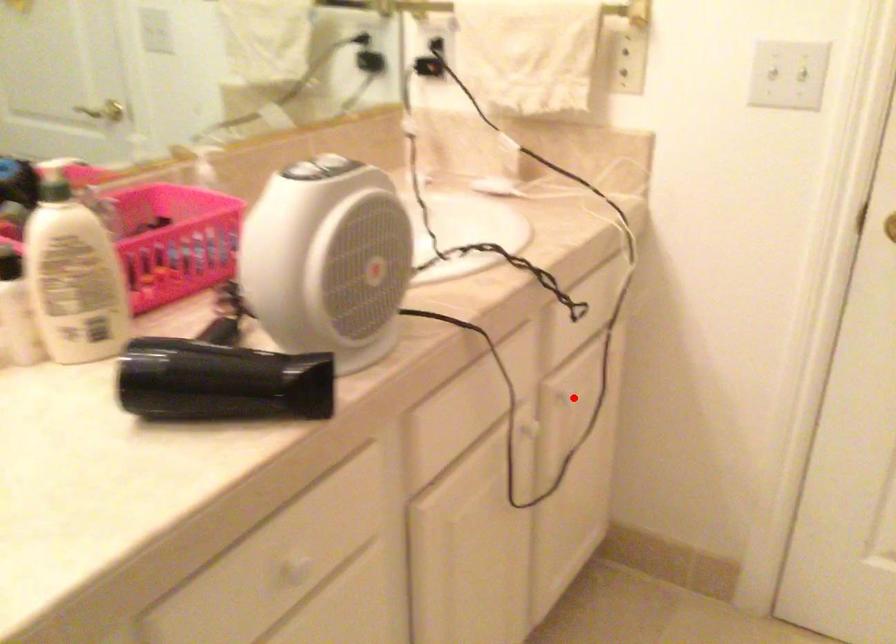
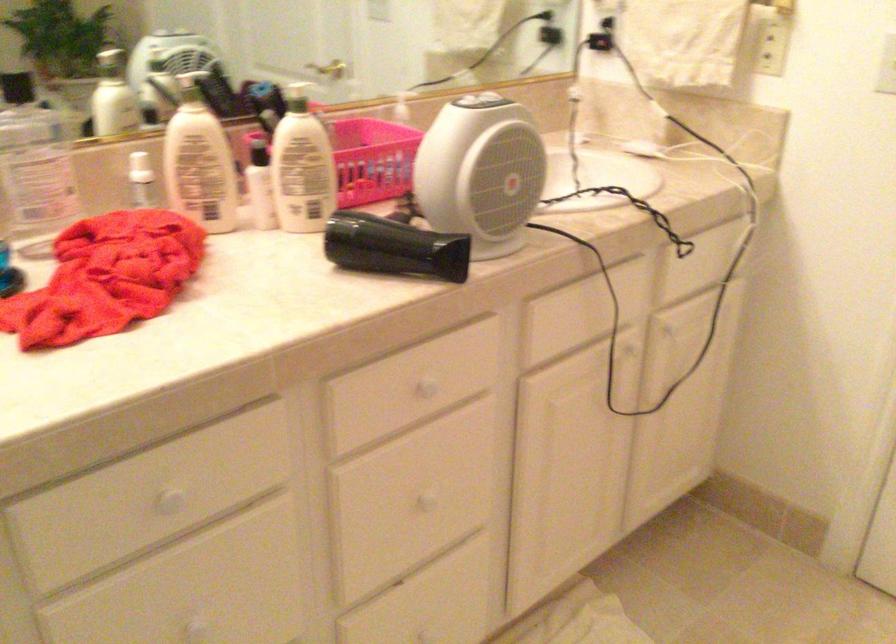
Question: I am providing you with two images of the same scene from different viewpoints. Given a red point in image1, look at the same physical point in image2. Is it:

Choices:
 (A) Closer to the viewpoint
 (B) Farther from the viewpoint

Answer: (B)